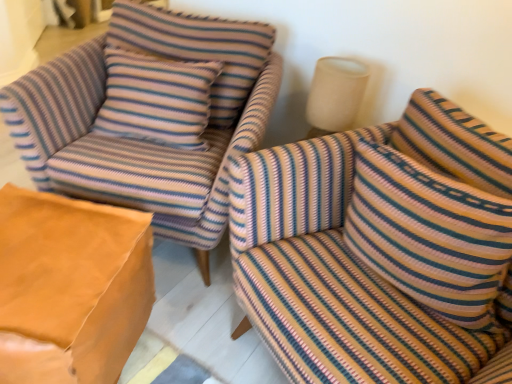
The height and width of the screenshot is (384, 512). Identify the location of free point above leather-like tan ottoman at lower left (from a real-world perspective). (48, 247).